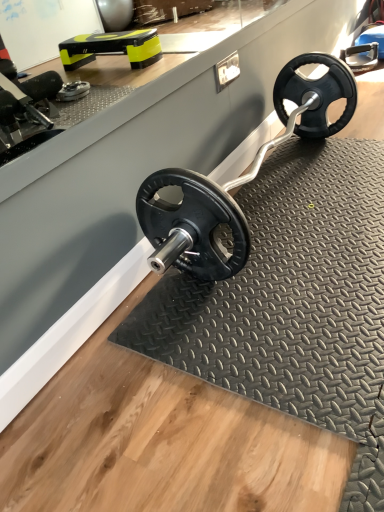
Question: Would you say black rubber weight plate at center is to the left or to the right of black rubber mat at center in the picture?

Choices:
 (A) right
 (B) left

Answer: (B)

Question: Looking at the image, does black rubber weight plate at center seem bigger or smaller compared to black rubber mat at center?

Choices:
 (A) big
 (B) small

Answer: (A)

Question: From the image's perspective, is black rubber weight plate at center located above or below black rubber mat at center?

Choices:
 (A) below
 (B) above

Answer: (B)

Question: Based on their positions, is black rubber mat at center located to the left or right of black rubber weight plate at center?

Choices:
 (A) right
 (B) left

Answer: (A)

Question: Looking at their shapes, would you say black rubber mat at center is wider or thinner than black rubber weight plate at center?

Choices:
 (A) thin
 (B) wide

Answer: (B)

Question: From a real-world perspective, is black rubber mat at center positioned above or below black rubber weight plate at center?

Choices:
 (A) above
 (B) below

Answer: (B)

Question: In the image, is black rubber mat at center positioned in front of or behind black rubber weight plate at center?

Choices:
 (A) behind
 (B) front

Answer: (B)